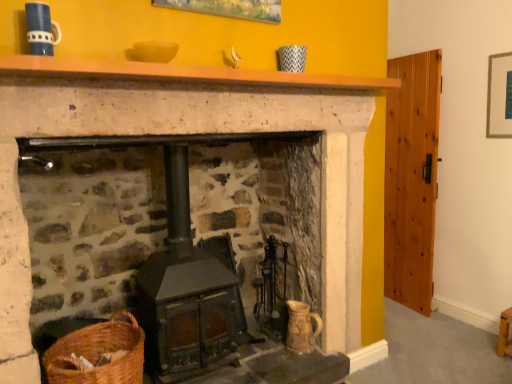
Question: Is rustic wood stove at center smaller than woven brown basket at lower left?

Choices:
 (A) yes
 (B) no

Answer: (B)

Question: Can you confirm if rustic wood stove at center is taller than woven brown basket at lower left?

Choices:
 (A) no
 (B) yes

Answer: (B)

Question: From a real-world perspective, does rustic wood stove at center sit lower than woven brown basket at lower left?

Choices:
 (A) yes
 (B) no

Answer: (B)

Question: Is woven brown basket at lower left at the back of rustic wood stove at center?

Choices:
 (A) no
 (B) yes

Answer: (A)

Question: Considering the relative positions of rustic wood stove at center and woven brown basket at lower left in the image provided, is rustic wood stove at center behind woven brown basket at lower left?

Choices:
 (A) yes
 (B) no

Answer: (A)

Question: Is rustic wood stove at center to the left or to the right of woven brown basket at lower left in the image?

Choices:
 (A) right
 (B) left

Answer: (A)

Question: Is rustic wood stove at center taller or shorter than woven brown basket at lower left?

Choices:
 (A) short
 (B) tall

Answer: (B)

Question: Does point (208, 261) appear closer or farther from the camera than point (117, 370)?

Choices:
 (A) closer
 (B) farther

Answer: (B)

Question: From the image's perspective, relative to woven brown basket at lower left, is rustic wood stove at center above or below?

Choices:
 (A) below
 (B) above

Answer: (B)

Question: Considering the positions of wooden stool at lower right and wooden mantle at upper center in the image, is wooden stool at lower right bigger or smaller than wooden mantle at upper center?

Choices:
 (A) small
 (B) big

Answer: (A)

Question: From their relative heights in the image, would you say wooden stool at lower right is taller or shorter than wooden mantle at upper center?

Choices:
 (A) tall
 (B) short

Answer: (A)

Question: Which is correct: wooden stool at lower right is inside wooden mantle at upper center, or outside of it?

Choices:
 (A) outside
 (B) inside

Answer: (A)

Question: Considering their positions, is wooden stool at lower right located in front of or behind wooden mantle at upper center?

Choices:
 (A) behind
 (B) front

Answer: (A)

Question: Considering the positions of wooden mantle at upper center and woven brown basket at lower left in the image, is wooden mantle at upper center bigger or smaller than woven brown basket at lower left?

Choices:
 (A) big
 (B) small

Answer: (B)

Question: Is wooden mantle at upper center wider or thinner than woven brown basket at lower left?

Choices:
 (A) wide
 (B) thin

Answer: (B)